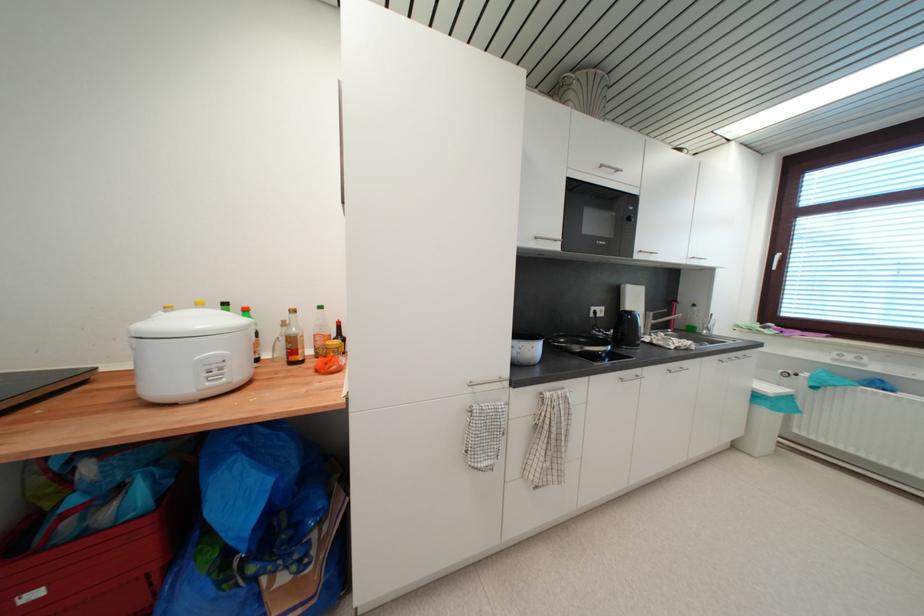
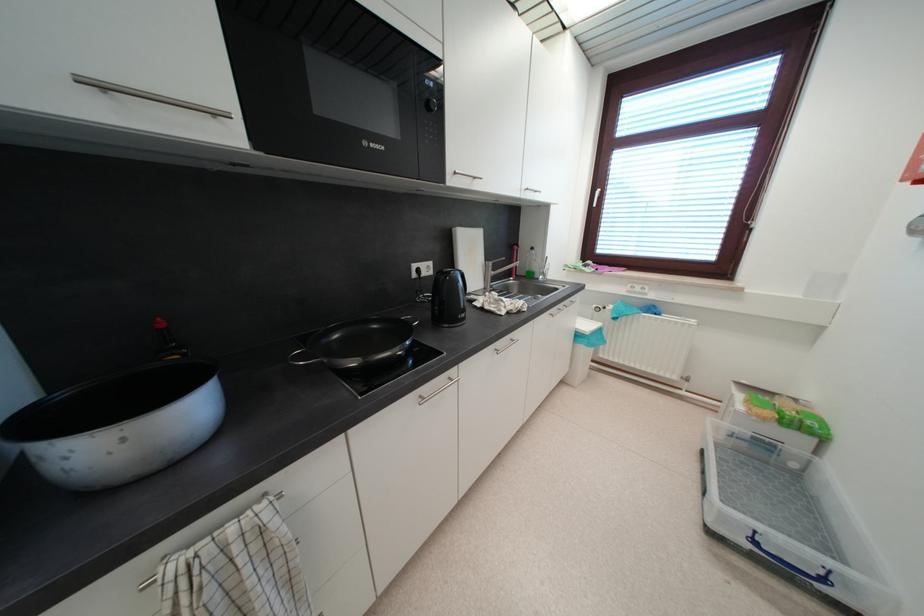
The point at [627,288] is marked in the first image. Where is the corresponding point in the second image?

(458, 232)